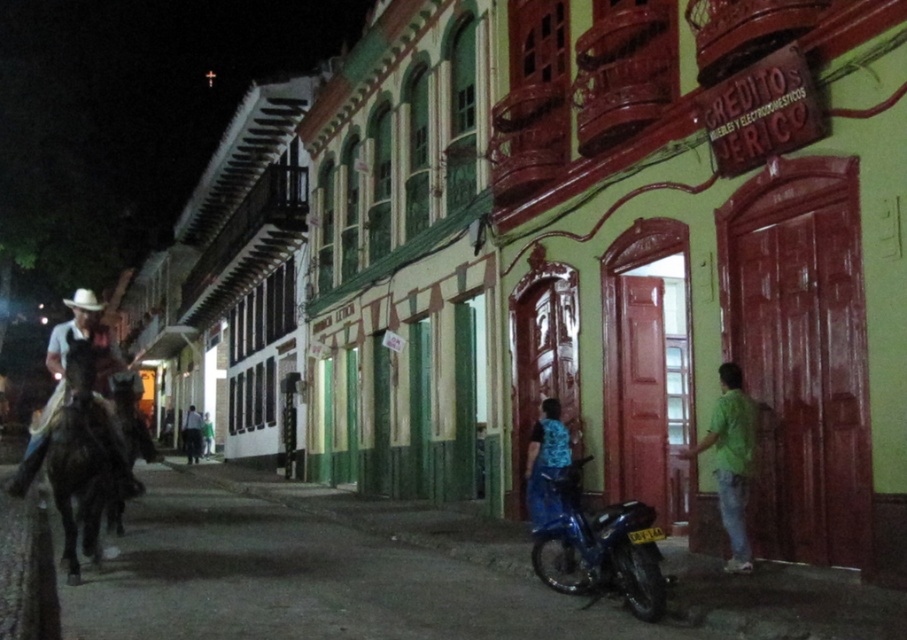
In the scene shown: Does shiny blue motorbike at lower center have a smaller size compared to green cotton shirt at right?

No.

Who is lower down, shiny blue motorbike at lower center or green cotton shirt at right?

shiny blue motorbike at lower center

Image resolution: width=907 pixels, height=640 pixels. What do you see at coordinates (603, 548) in the screenshot?
I see `shiny blue motorbike at lower center` at bounding box center [603, 548].

Locate an element on the screen. This screenshot has width=907, height=640. shiny blue motorbike at lower center is located at coordinates (603, 548).

Based on the photo, between brown glossy horse at left and light blue denim shirt at left, which one appears on the left side from the viewer's perspective?

Positioned to the left is light blue denim shirt at left.

Can you confirm if brown glossy horse at left is smaller than light blue denim shirt at left?

Correct, brown glossy horse at left occupies less space than light blue denim shirt at left.

Measure the distance between brown glossy horse at left and camera.

brown glossy horse at left and camera are 24.29 feet apart.

You are a GUI agent. You are given a task and a screenshot of the screen. Output one action in this format:
    pyautogui.click(x=<x>, y=<y>)
    Task: Click on the brown glossy horse at left
    
    Given the screenshot: What is the action you would take?
    [x=84, y=458]

Is light blue denim shirt at left wider than blue denim jeans at lower center?

Indeed, light blue denim shirt at left has a greater width compared to blue denim jeans at lower center.

Does point (80, 326) lie behind point (541, 429)?

No, (80, 326) is closer to viewer.

Between point (118, 472) and point (561, 435), which one is positioned behind?

Positioned behind is point (561, 435).

Locate an element on the screen. This screenshot has height=640, width=907. light blue denim shirt at left is located at coordinates (64, 376).